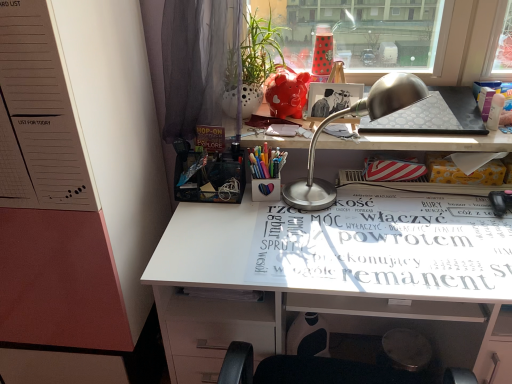
Question: Is translucent plastic bottle at upper right, marked as the 1th stationery in a top-to-bottom arrangement, outside white dotted pot at upper center?

Choices:
 (A) yes
 (B) no

Answer: (A)

Question: From a real-world perspective, is translucent plastic bottle at upper right, marked as the 1th stationery in a top-to-bottom arrangement, positioned under white dotted pot at upper center based on gravity?

Choices:
 (A) yes
 (B) no

Answer: (A)

Question: Is translucent plastic bottle at upper right, the 1th stationery from the right, taller than white dotted pot at upper center?

Choices:
 (A) no
 (B) yes

Answer: (A)

Question: Is translucent plastic bottle at upper right, the 1th stationery from the right, beside white dotted pot at upper center?

Choices:
 (A) yes
 (B) no

Answer: (B)

Question: Is white dotted pot at upper center a part of translucent plastic bottle at upper right, marked as the 1th stationery in a top-to-bottom arrangement?

Choices:
 (A) no
 (B) yes

Answer: (A)

Question: Does translucent plastic bottle at upper right, marked as the 1th stationery in a top-to-bottom arrangement, appear on the right side of white dotted pot at upper center?

Choices:
 (A) no
 (B) yes

Answer: (B)

Question: Is silver metallic desk lamp at upper center shorter than translucent plastic bottle at upper right, the 1th stationery from the right?

Choices:
 (A) yes
 (B) no

Answer: (B)

Question: From the image's perspective, is silver metallic desk lamp at upper center located beneath translucent plastic bottle at upper right, the 1th stationery from the right?

Choices:
 (A) no
 (B) yes

Answer: (B)

Question: Could you tell me if silver metallic desk lamp at upper center is turned towards translucent plastic bottle at upper right, the second stationery from the bottom?

Choices:
 (A) yes
 (B) no

Answer: (B)

Question: Does silver metallic desk lamp at upper center have a greater height compared to translucent plastic bottle at upper right, the second stationery from the bottom?

Choices:
 (A) no
 (B) yes

Answer: (B)

Question: Does silver metallic desk lamp at upper center appear on the right side of translucent plastic bottle at upper right, the 1th stationery from the right?

Choices:
 (A) no
 (B) yes

Answer: (A)

Question: Does silver metallic desk lamp at upper center touch translucent plastic bottle at upper right, the second stationery from the bottom?

Choices:
 (A) yes
 (B) no

Answer: (B)

Question: Considering the relative sizes of white glossy desk at center and translucent plastic bottle at upper right, acting as the 2th stationery starting from the left, in the image provided, is white glossy desk at center wider than translucent plastic bottle at upper right, acting as the 2th stationery starting from the left,?

Choices:
 (A) yes
 (B) no

Answer: (A)